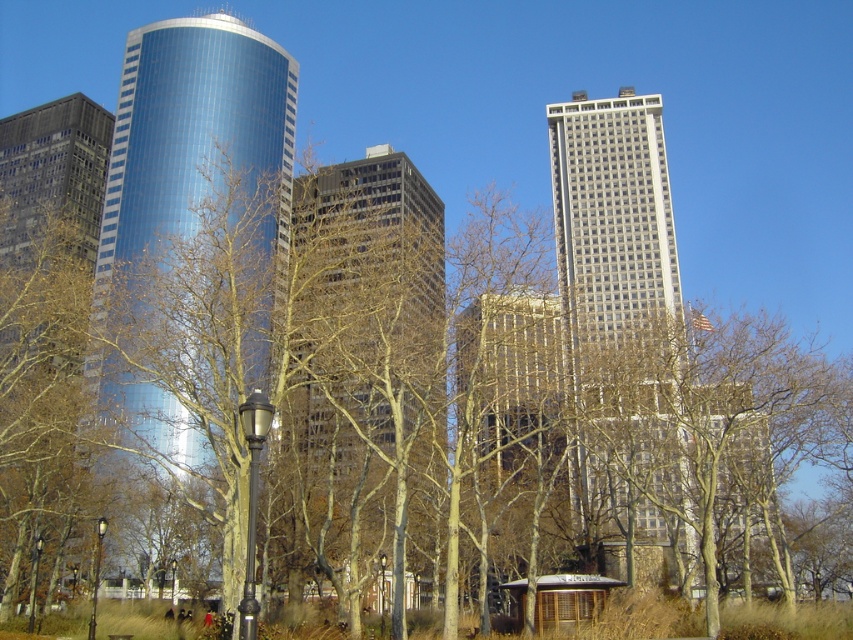
You are standing at the origin point in the image. Which direction should you look to see the brown glassy building at center?

The brown glassy building at center is located at coordinates 0.539 on the x and 0.427 on the y axis, so you should look towards the upper right direction from your current position.

You are an architect analyzing the urban skyline. Based on the image, which of the two buildings, the glossy glass tower at center or the gray glass skyscraper at center, is positioned higher in the visual field?

The glossy glass tower at center is positioned higher in the visual field than the gray glass skyscraper at center according to the description.

Looking at this image, you are an architect analyzing the urban layout. Based on the scene, which building is closer to you between the brown glassy building at center and the gray glass skyscraper at center?

The brown glassy building at center is closer because it is positioned in front of the gray glass skyscraper at center.